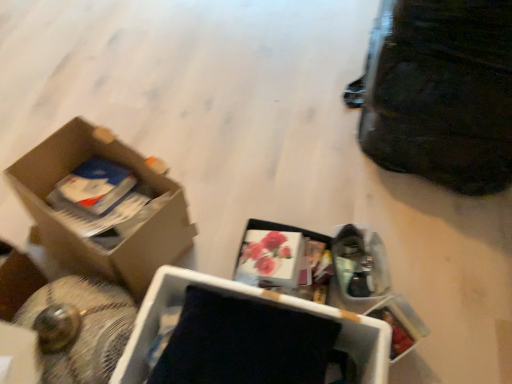
This screenshot has height=384, width=512. In order to click on vacant space behind cardboard box at left, acting as the 2th box starting from the right in this screenshot , I will do `click(167, 135)`.